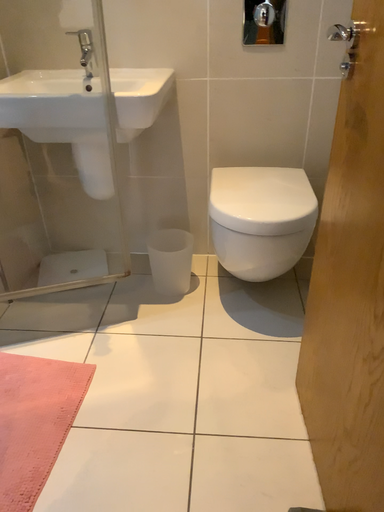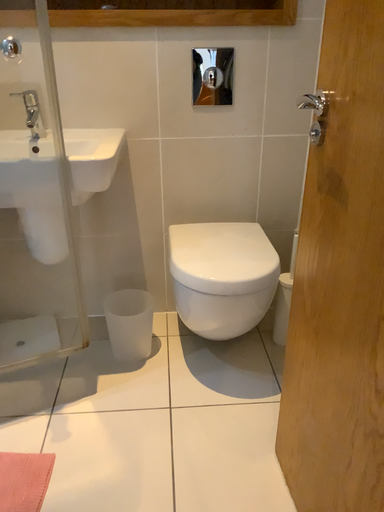
Question: Which way did the camera rotate in the video?

Choices:
 (A) rotated left
 (B) rotated right

Answer: (B)